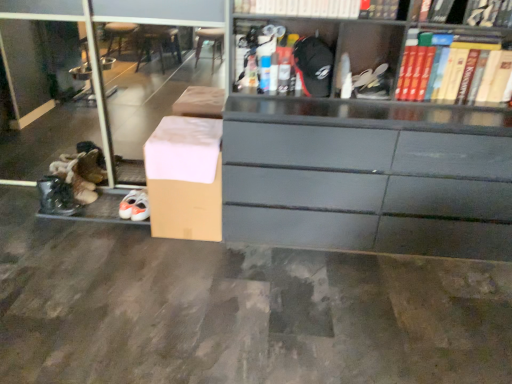
Question: Is white matte shoe at upper center to the left of hardcover book at upper right, the first book from the right, from the viewer's perspective?

Choices:
 (A) no
 (B) yes

Answer: (B)

Question: From the image's perspective, is white matte shoe at upper center on hardcover book at upper right, which is counted as the fourth book, starting from the left?

Choices:
 (A) no
 (B) yes

Answer: (A)

Question: From a real-world perspective, is white matte shoe at upper center below hardcover book at upper right, the first book from the right?

Choices:
 (A) yes
 (B) no

Answer: (A)

Question: Does white matte shoe at upper center have a larger size compared to hardcover book at upper right, which is counted as the fourth book, starting from the left?

Choices:
 (A) yes
 (B) no

Answer: (B)

Question: Is white matte shoe at upper center not within hardcover book at upper right, which is counted as the fourth book, starting from the left?

Choices:
 (A) no
 (B) yes

Answer: (B)

Question: Would you say hardcover book at upper right, which is counted as the 2th book, starting from the right, is inside or outside brown cardboard box at lower left?

Choices:
 (A) inside
 (B) outside

Answer: (B)

Question: Is point (457, 46) closer or farther from the camera than point (5, 3)?

Choices:
 (A) closer
 (B) farther

Answer: (A)

Question: Considering their positions, is hardcover book at upper right, which is counted as the 2th book, starting from the right, located in front of or behind brown cardboard box at lower left?

Choices:
 (A) front
 (B) behind

Answer: (A)

Question: From a real-world perspective, is hardcover book at upper right, which is counted as the 2th book, starting from the right, above or below brown cardboard box at lower left?

Choices:
 (A) above
 (B) below

Answer: (A)

Question: In the image, is white matte shoe at upper center positioned in front of or behind hardcover book at upper center, marked as the first book in a left-to-right arrangement?

Choices:
 (A) front
 (B) behind

Answer: (B)

Question: Would you say white matte shoe at upper center is to the left or to the right of hardcover book at upper center, marked as the first book in a left-to-right arrangement, in the picture?

Choices:
 (A) left
 (B) right

Answer: (B)

Question: Based on their sizes in the image, would you say white matte shoe at upper center is bigger or smaller than hardcover book at upper center, marked as the first book in a left-to-right arrangement?

Choices:
 (A) big
 (B) small

Answer: (B)

Question: From a real-world perspective, relative to hardcover book at upper center, which is the fourth book from right to left, is white matte shoe at upper center vertically above or below?

Choices:
 (A) below
 (B) above

Answer: (A)

Question: Is brown cardboard box at lower left in front of or behind hardcover book at upper right, which is counted as the fourth book, starting from the left, in the image?

Choices:
 (A) behind
 (B) front

Answer: (A)

Question: Is brown cardboard box at lower left taller or shorter than hardcover book at upper right, which is counted as the fourth book, starting from the left?

Choices:
 (A) short
 (B) tall

Answer: (B)